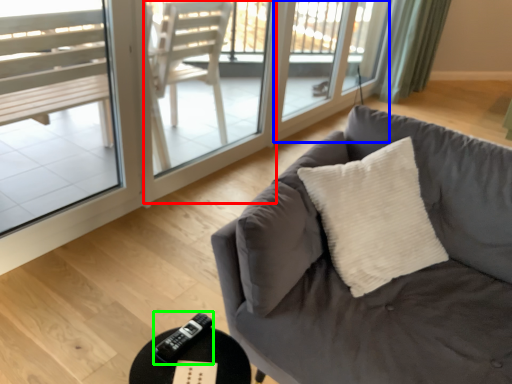
Question: Which is farther away from screen door (highlighted by a red box)? screen door (highlighted by a blue box) or remote (highlighted by a green box)?

Choices:
 (A) screen door
 (B) remote

Answer: (B)